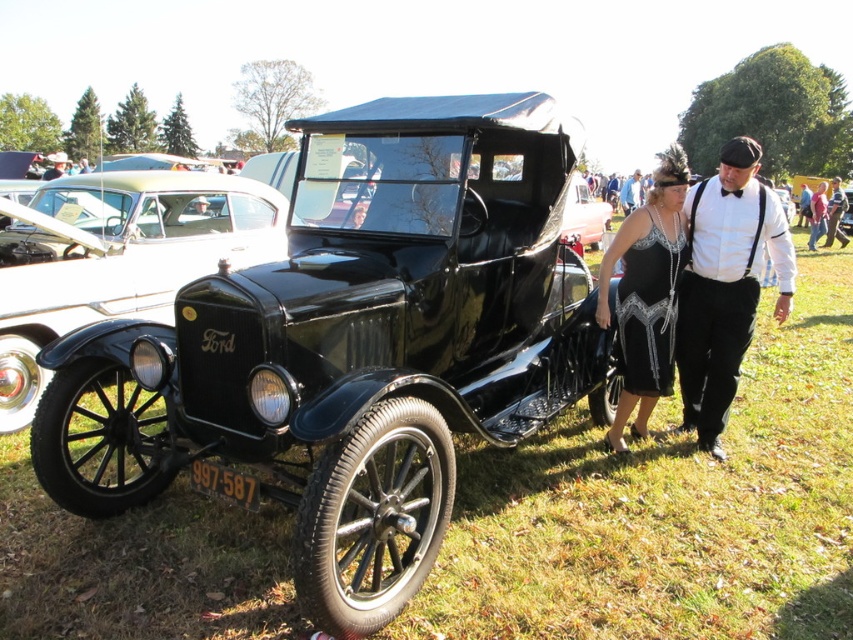
You are attending a classic car show and notice two people dressed in period clothing standing near the vintage Ford Model T. The woman is wearing a black satin dress at center, and the man is wearing a white cotton shirt at center. Which article of clothing is shorter in length?

The white cotton shirt at center is shorter than the black satin dress at center.

You are a photographer at the classic car show and want to capture the vintage Ford Model T car along with the two individuals. You notice the white cotton shirt at center and the black leather jacket at center. Which clothing item is positioned lower on the person?

The white cotton shirt at center is below the black leather jacket at center, so the white cotton shirt at center is positioned lower on the person.

You are a photographer planning to take a group photo of the black satin dress at center and the black leather jacket at center. If you want to ensure both subjects are fully visible in the frame, which subject should you position closer to the camera to avoid cropping?

The black leather jacket at center should be positioned closer to the camera because the black satin dress at center might be wider than the black leather jacket at center, making it harder to fit within the frame if placed too far back.